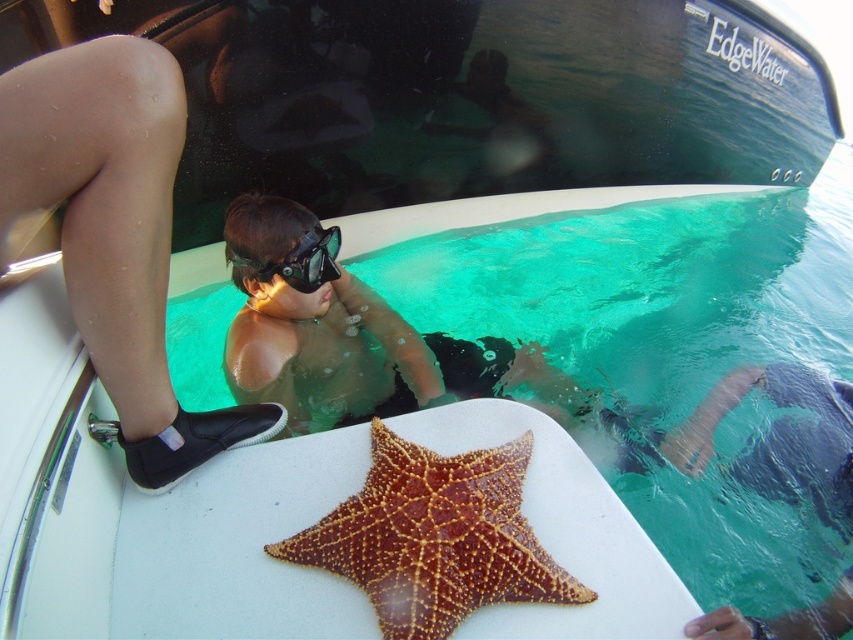
Does brown spiny starfish at center appear under black matte goggles at center?

Yes, brown spiny starfish at center is below black matte goggles at center.

Does point (415, 528) come farther from viewer compared to point (292, 262)?

No, it is not.

Where is `brown spiny starfish at center`? The height and width of the screenshot is (640, 853). brown spiny starfish at center is located at coordinates (434, 538).

You are a GUI agent. You are given a task and a screenshot of the screen. Output one action in this format:
    pyautogui.click(x=<x>, y=<y>)
    Task: Click on the brown spiny starfish at center
    This screenshot has height=640, width=853.
    Given the screenshot: What is the action you would take?
    pyautogui.click(x=434, y=538)